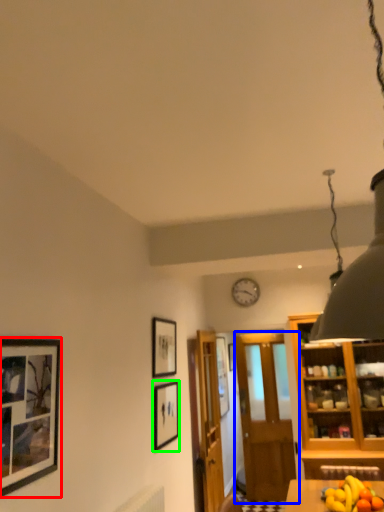
Question: Estimate the real-world distances between objects in this image. Which object is closer to picture frame (highlighted by a red box), door (highlighted by a blue box) or picture frame (highlighted by a green box)?

Choices:
 (A) door
 (B) picture frame

Answer: (B)